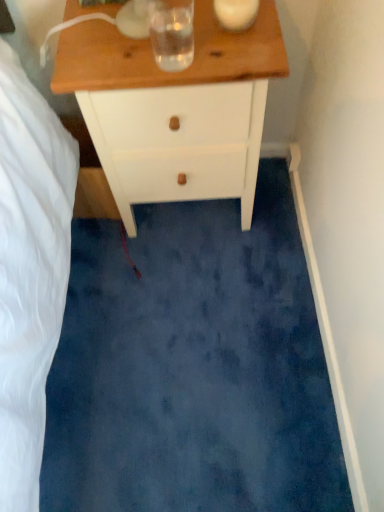
You are a GUI agent. You are given a task and a screenshot of the screen. Output one action in this format:
    pyautogui.click(x=<x>, y=<y>)
    Task: Click on the vacant space behind clear glass water at upper center
    The height and width of the screenshot is (512, 384).
    Given the screenshot: What is the action you would take?
    pyautogui.click(x=158, y=30)